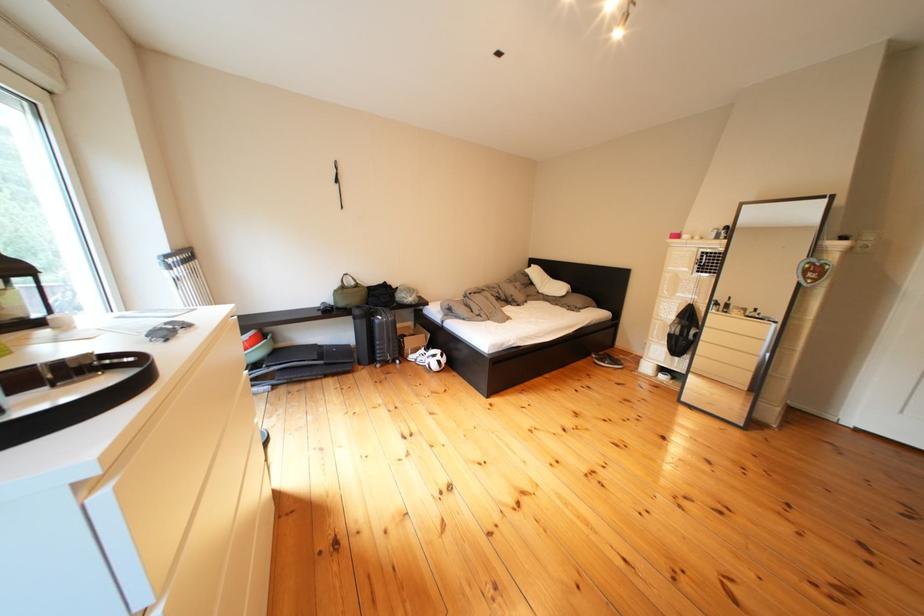
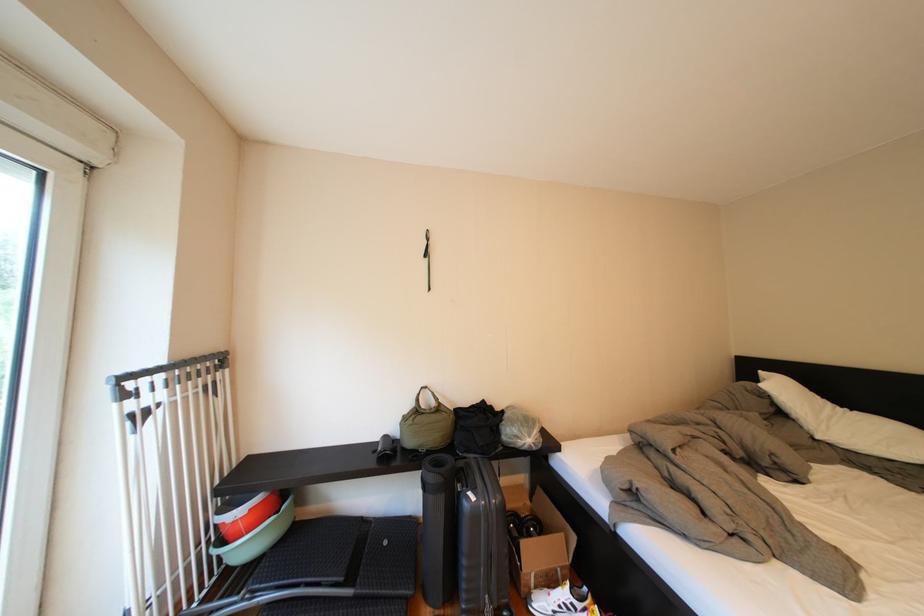
Question: I am providing you with two images of the same scene from different viewpoints. After the viewpoint changes to image2, which objects are now occluded?

Choices:
 (A) roller shutter cord
 (B) white pillow
 (C) black wall strap
 (D) none of these

Answer: (D)